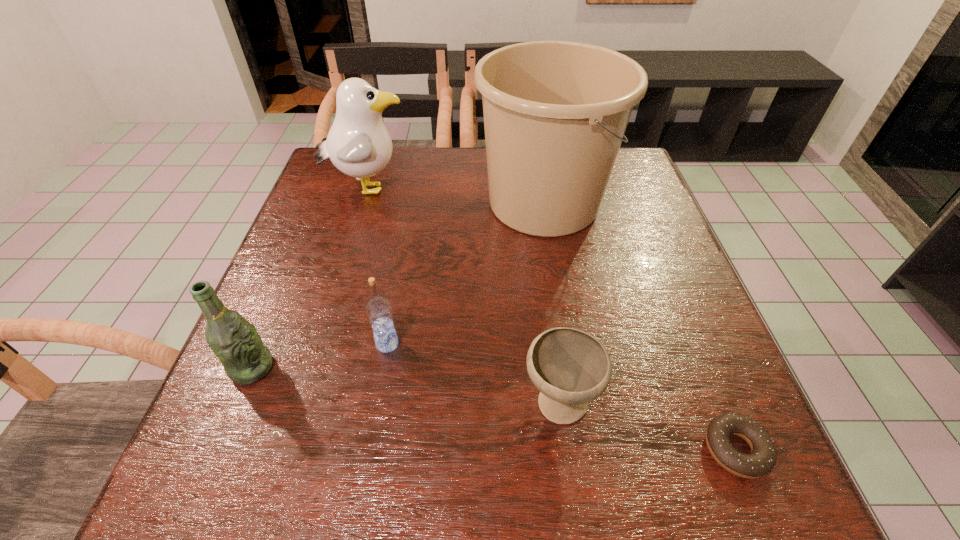
Find the location of a particular element. The width and height of the screenshot is (960, 540). object at the far left corner is located at coordinates (358, 144).

The width and height of the screenshot is (960, 540). I want to click on object that is at the far right corner, so click(x=555, y=113).

The image size is (960, 540). Find the location of `object that is at the near right corner`. object that is at the near right corner is located at coordinates (762, 459).

Where is `vacant space at the far edge`? vacant space at the far edge is located at coordinates (416, 188).

In the image, there is a desktop. Identify the location of vacant space at the left edge. (303, 341).

In the image, there is a desktop. Where is `vacant space at the right edge`? The width and height of the screenshot is (960, 540). vacant space at the right edge is located at coordinates (649, 306).

At what (x,y) coordinates should I click in order to perform the action: click on vacant space at the near left corner of the desktop. Please return your answer as a coordinate pair (x, y). This screenshot has width=960, height=540. Looking at the image, I should click on (222, 504).

Where is `free space that is in between the bucket and the shortest object`? free space that is in between the bucket and the shortest object is located at coordinates (639, 326).

In order to click on free space between the bucket and the rightmost object in this screenshot , I will do coord(639,326).

Where is `vacant space that is in between the bucket and the doughnut`? vacant space that is in between the bucket and the doughnut is located at coordinates (639, 326).